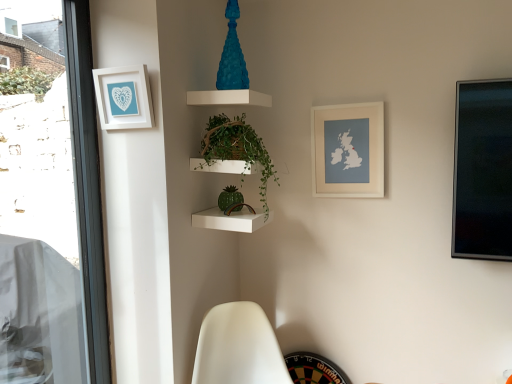
Where is `transparent glass window at left`? This screenshot has width=512, height=384. transparent glass window at left is located at coordinates (87, 185).

Locate an element on the screen. This screenshot has width=512, height=384. white matte map at upper right, which is the 2th picture frame in front-to-back order is located at coordinates (348, 150).

Considering the positions of objects green glossy plant at center and white matte swivel chair at lower center in the image provided, who is more to the left, green glossy plant at center or white matte swivel chair at lower center?

green glossy plant at center.

Who is taller, green glossy plant at center or white matte swivel chair at lower center?

green glossy plant at center is taller.

Considering the relative sizes of green glossy plant at center and white matte swivel chair at lower center in the image provided, is green glossy plant at center wider than white matte swivel chair at lower center?

No, green glossy plant at center is not wider than white matte swivel chair at lower center.

Measure the distance between green glossy plant at center and white matte swivel chair at lower center.

green glossy plant at center and white matte swivel chair at lower center are 23.36 inches apart.

Is transparent glass window at left aimed at white matte picture frame at upper left, the 1th picture frame viewed from the left?

Yes, transparent glass window at left is oriented towards white matte picture frame at upper left, the 1th picture frame viewed from the left.

Between transparent glass window at left and white matte picture frame at upper left, the 1th picture frame from the front, which one has larger size?

With larger size is transparent glass window at left.

How many degrees apart are the facing directions of transparent glass window at left and white matte picture frame at upper left, the 1th picture frame viewed from the left?

There is a 89.9-degree angle between the facing directions of transparent glass window at left and white matte picture frame at upper left, the 1th picture frame viewed from the left.

Considering the positions of points (90, 208) and (132, 127), is point (90, 208) closer to camera compared to point (132, 127)?

No, it is not.

Looking at this image, does white matte picture frame at upper left, the 1th picture frame from the front, appear on the right side of green glossy plant at center?

Incorrect, white matte picture frame at upper left, the 1th picture frame from the front, is not on the right side of green glossy plant at center.

From a real-world perspective, is white matte picture frame at upper left, the 1th picture frame viewed from the left, over green glossy plant at center?

Correct, in the physical world, white matte picture frame at upper left, the 1th picture frame viewed from the left, is higher than green glossy plant at center.

This screenshot has width=512, height=384. I want to click on picture frame on the left of the green glossy plant at center, so click(x=123, y=97).

Considering the points (114, 125) and (219, 143), which point is in front, point (114, 125) or point (219, 143)?

The point (114, 125) is closer.

Identify the location of swivel chair that appears on the right of transparent glass window at left. (238, 347).

Between point (289, 374) and point (77, 167), which one is positioned in front?

The point (77, 167) is more forward.

Is white matte swivel chair at lower center behind transparent glass window at left?

Yes, white matte swivel chair at lower center is further from the viewer.

From a real-world perspective, does white matte swivel chair at lower center sit lower than transparent glass window at left?

Indeed, from a real-world perspective, white matte swivel chair at lower center is positioned beneath transparent glass window at left.

Between green glossy plant at center and transparent glass window at left, which one has larger size?

transparent glass window at left.

Image resolution: width=512 pixels, height=384 pixels. I want to click on houseplant located above the transparent glass window at left (from a real-world perspective), so click(x=237, y=149).

Is green glossy plant at center turned away from transparent glass window at left?

That's not correct — green glossy plant at center is not looking away from transparent glass window at left.

Is white matte map at upper right, which is the 2th picture frame in front-to-back order, aimed at white matte swivel chair at lower center?

No, white matte map at upper right, which is the 2th picture frame in front-to-back order, does not turn towards white matte swivel chair at lower center.

Does white matte map at upper right, marked as the 1th picture frame in a back-to-front arrangement, have a lesser width compared to white matte swivel chair at lower center?

Indeed, white matte map at upper right, marked as the 1th picture frame in a back-to-front arrangement, has a lesser width compared to white matte swivel chair at lower center.

In the scene shown: Between white matte map at upper right, which is the 2th picture frame in front-to-back order, and white matte swivel chair at lower center, which one has smaller size?

white matte map at upper right, which is the 2th picture frame in front-to-back order, is smaller.

Where is `picture frame that is the 2nd object located behind the white matte swivel chair at lower center`? The width and height of the screenshot is (512, 384). picture frame that is the 2nd object located behind the white matte swivel chair at lower center is located at coordinates (348, 150).

Which of these two, transparent glass window at left or white matte map at upper right, positioned as the 2th picture frame in left-to-right order, is thinner?

Thinner between the two is white matte map at upper right, positioned as the 2th picture frame in left-to-right order.

Would you say transparent glass window at left is a long distance from white matte map at upper right, placed as the first picture frame when sorted from right to left?

Yes, transparent glass window at left and white matte map at upper right, placed as the first picture frame when sorted from right to left, are quite far apart.

Is transparent glass window at left positioned before white matte map at upper right, placed as the first picture frame when sorted from right to left?

Answer: Yes, it is.

This screenshot has height=384, width=512. I want to click on houseplant on the left of white matte swivel chair at lower center, so click(237, 149).

Which picture frame is the 1st one when counting from the back of the transparent glass window at left? Please provide its 2D coordinates.

[(123, 97)]

In the scene shown: Considering their positions, is transparent glass window at left positioned further to white matte swivel chair at lower center than white matte map at upper right, marked as the 1th picture frame in a back-to-front arrangement?

Among the two, white matte map at upper right, marked as the 1th picture frame in a back-to-front arrangement, is located further to white matte swivel chair at lower center.

Which object lies nearer to the anchor point white matte picture frame at upper left, the 1th picture frame from the front, green glossy plant at center or transparent glass window at left?

The object closer to white matte picture frame at upper left, the 1th picture frame from the front, is transparent glass window at left.

Looking at the image, which one is located further to white matte map at upper right, placed as the first picture frame when sorted from right to left, green glossy plant at center or white matte swivel chair at lower center?

white matte swivel chair at lower center is positioned further to the anchor white matte map at upper right, placed as the first picture frame when sorted from right to left.

Considering their positions, is white matte picture frame at upper left, the 2th picture frame from the back, positioned closer to white matte map at upper right, placed as the first picture frame when sorted from right to left, than transparent glass window at left?

white matte picture frame at upper left, the 2th picture frame from the back, lies closer to white matte map at upper right, placed as the first picture frame when sorted from right to left, than the other object.

From the picture: From the image, which object appears to be nearer to white matte picture frame at upper left, the 2th picture frame from the back, green glossy plant at center or white matte swivel chair at lower center?

Based on the image, green glossy plant at center appears to be nearer to white matte picture frame at upper left, the 2th picture frame from the back.

Based on their spatial positions, is white matte map at upper right, which is the 2th picture frame in front-to-back order, or green glossy plant at center further from transparent glass window at left?

Among the two, white matte map at upper right, which is the 2th picture frame in front-to-back order, is located further to transparent glass window at left.

When comparing their distances from white matte swivel chair at lower center, does green glossy plant at center or transparent glass window at left seem further?

green glossy plant at center lies further to white matte swivel chair at lower center than the other object.

From the image, which object appears to be farther from green glossy plant at center, white matte map at upper right, which is the 2th picture frame in front-to-back order, or white matte swivel chair at lower center?

white matte swivel chair at lower center is positioned further to the anchor green glossy plant at center.

This screenshot has width=512, height=384. What are the coordinates of `houseplant between transparent glass window at left and white matte map at upper right, placed as the first picture frame when sorted from right to left` in the screenshot? It's located at (237, 149).

The width and height of the screenshot is (512, 384). I want to click on picture frame between white matte picture frame at upper left, the 2th picture frame from the back, and white matte swivel chair at lower center vertically, so click(x=348, y=150).

Locate an element on the screen. This screenshot has width=512, height=384. swivel chair situated between transparent glass window at left and white matte map at upper right, which is the 2th picture frame in front-to-back order, from left to right is located at coordinates (238, 347).

The image size is (512, 384). I want to click on picture frame situated between transparent glass window at left and green glossy plant at center from left to right, so click(x=123, y=97).